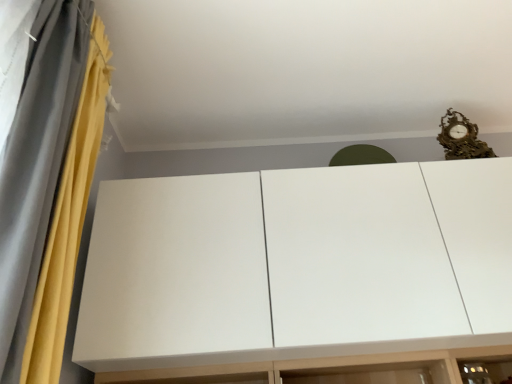
Question: From the image's perspective, is yellow fabric curtain at left positioned above or below white matte cupboard at upper center?

Choices:
 (A) below
 (B) above

Answer: (B)

Question: Is point (96, 102) closer or farther from the camera than point (407, 337)?

Choices:
 (A) farther
 (B) closer

Answer: (A)

Question: Relative to white matte cupboard at upper center, is yellow fabric curtain at left in front or behind?

Choices:
 (A) front
 (B) behind

Answer: (A)

Question: Is white matte cupboard at upper center taller or shorter than yellow fabric curtain at left?

Choices:
 (A) short
 (B) tall

Answer: (A)

Question: Based on their sizes in the image, would you say white matte cupboard at upper center is bigger or smaller than yellow fabric curtain at left?

Choices:
 (A) small
 (B) big

Answer: (B)

Question: In terms of width, does white matte cupboard at upper center look wider or thinner when compared to yellow fabric curtain at left?

Choices:
 (A) thin
 (B) wide

Answer: (B)

Question: From the image's perspective, relative to yellow fabric curtain at left, is white matte cupboard at upper center above or below?

Choices:
 (A) below
 (B) above

Answer: (A)